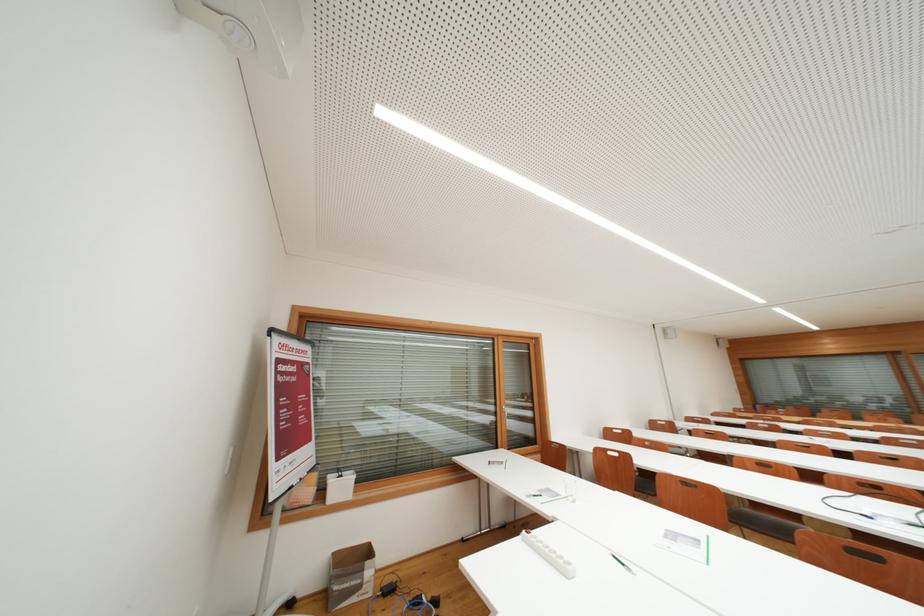
At what (x,y) coordinates should I click in order to perform the action: click on open cardboard box. Please return your answer as a coordinate pair (x, y). Image resolution: width=924 pixels, height=616 pixels. Looking at the image, I should click on (350, 575).